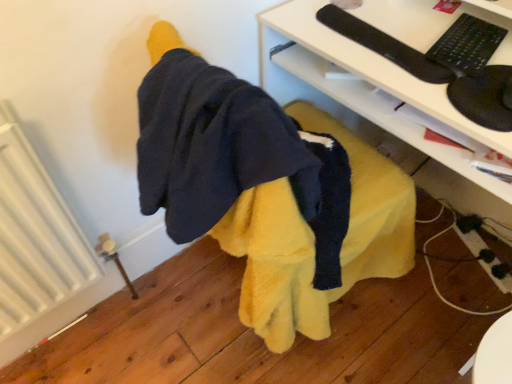
Question: Is black matte keyboard at upper right to the left of white ribbed radiator at left from the viewer's perspective?

Choices:
 (A) no
 (B) yes

Answer: (A)

Question: Is black matte keyboard at upper right oriented towards white ribbed radiator at left?

Choices:
 (A) yes
 (B) no

Answer: (B)

Question: From the image's perspective, does black matte keyboard at upper right appear lower than white ribbed radiator at left?

Choices:
 (A) no
 (B) yes

Answer: (A)

Question: From a real-world perspective, is black matte keyboard at upper right positioned under white ribbed radiator at left based on gravity?

Choices:
 (A) yes
 (B) no

Answer: (B)

Question: Does black matte keyboard at upper right have a larger size compared to white ribbed radiator at left?

Choices:
 (A) yes
 (B) no

Answer: (B)

Question: Is black matte keyboard at upper right next to white ribbed radiator at left?

Choices:
 (A) yes
 (B) no

Answer: (B)

Question: From the image's perspective, is white ribbed radiator at left under black matte keyboard at upper right?

Choices:
 (A) yes
 (B) no

Answer: (A)

Question: Would you say white ribbed radiator at left contains black matte keyboard at upper right?

Choices:
 (A) yes
 (B) no

Answer: (B)

Question: Does white ribbed radiator at left have a lesser width compared to black matte keyboard at upper right?

Choices:
 (A) no
 (B) yes

Answer: (B)

Question: From a real-world perspective, does white ribbed radiator at left stand above black matte keyboard at upper right?

Choices:
 (A) no
 (B) yes

Answer: (A)

Question: Can you confirm if white ribbed radiator at left is taller than black matte keyboard at upper right?

Choices:
 (A) no
 (B) yes

Answer: (B)

Question: Is white ribbed radiator at left oriented away from black matte keyboard at upper right?

Choices:
 (A) yes
 (B) no

Answer: (B)

Question: Considering the relative positions of black matte keyboard at upper right and white glossy desk at center in the image provided, is black matte keyboard at upper right to the right of white glossy desk at center from the viewer's perspective?

Choices:
 (A) yes
 (B) no

Answer: (B)